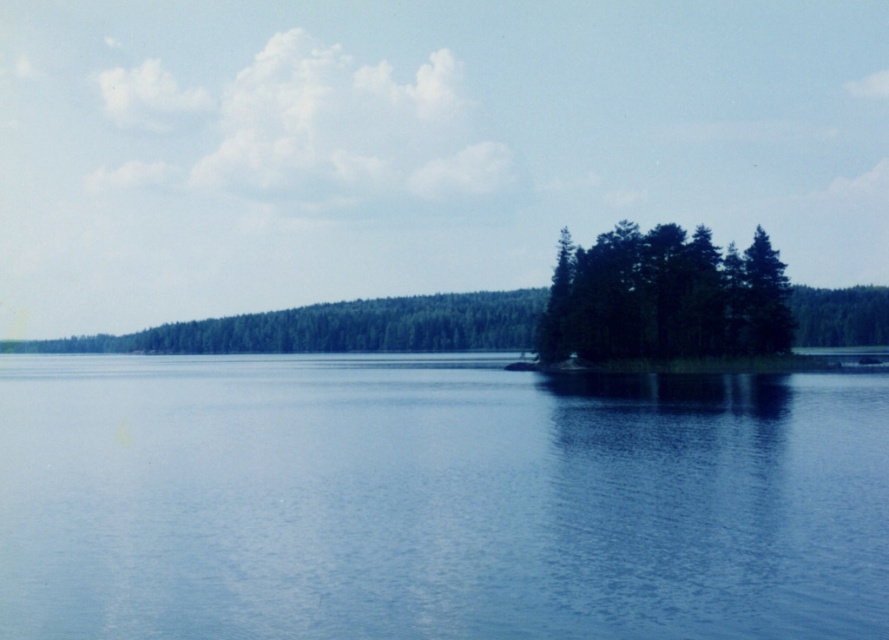
You are a bird flying over the lakeside and want to land on the tallest tree. Which one should you choose between the green matte trees at center and the green matte tree at right?

The green matte tree at right is taller than the green matte trees at center, so you should choose the green matte tree at right to land on.

You are standing at the lakeside and notice the blue smooth water at center and the green matte trees at center. Which object is positioned to the left of the other?

The blue smooth water at center is positioned to the left of green matte trees at center.

You are a bird flying over the lakeside scene. You see the green matte trees at center and the green matte tree at right. Which one is positioned lower in the image from your perspective?

The green matte trees at center is positioned lower than the green matte tree at right.